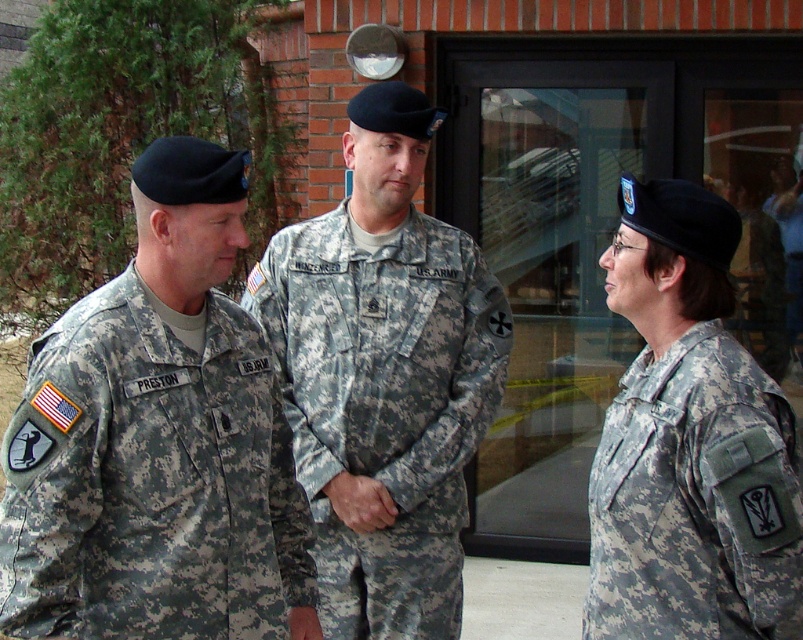
Between camouflage fabric uniform at left and camouflage uniform at center, which one has less height?

With less height is camouflage fabric uniform at left.

Is point (272, 419) positioned behind point (428, 417)?

That is False.

You are a GUI agent. You are given a task and a screenshot of the screen. Output one action in this format:
    pyautogui.click(x=<x>, y=<y>)
    Task: Click on the camouflage fabric uniform at left
    
    Given the screenshot: What is the action you would take?
    149,481

Does camouflage fabric uniform at left have a greater height compared to camouflage fabric uniform at right?

Yes.

Is point (47, 544) positioned in front of point (638, 419)?

Yes, it is.

Find the location of a particular element. The height and width of the screenshot is (640, 803). camouflage fabric uniform at left is located at coordinates (149, 481).

Which of these two, camouflage uniform at center or camouflage fabric uniform at right, stands shorter?

With less height is camouflage fabric uniform at right.

Where is `camouflage uniform at center`? This screenshot has width=803, height=640. camouflage uniform at center is located at coordinates (384, 376).

Find the location of a particular element. camouflage uniform at center is located at coordinates (384, 376).